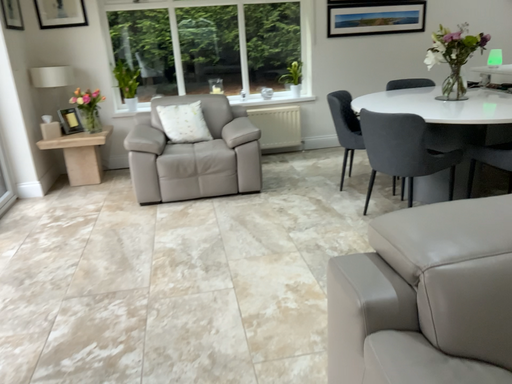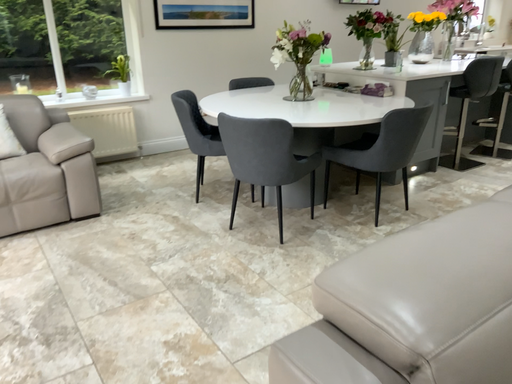
Question: Which way did the camera rotate in the video?

Choices:
 (A) rotated right
 (B) rotated left

Answer: (A)